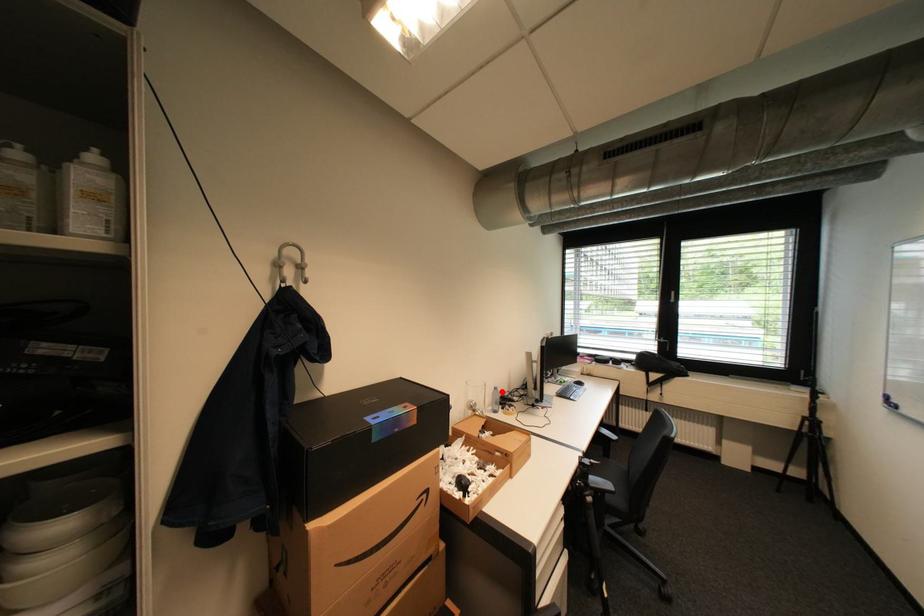
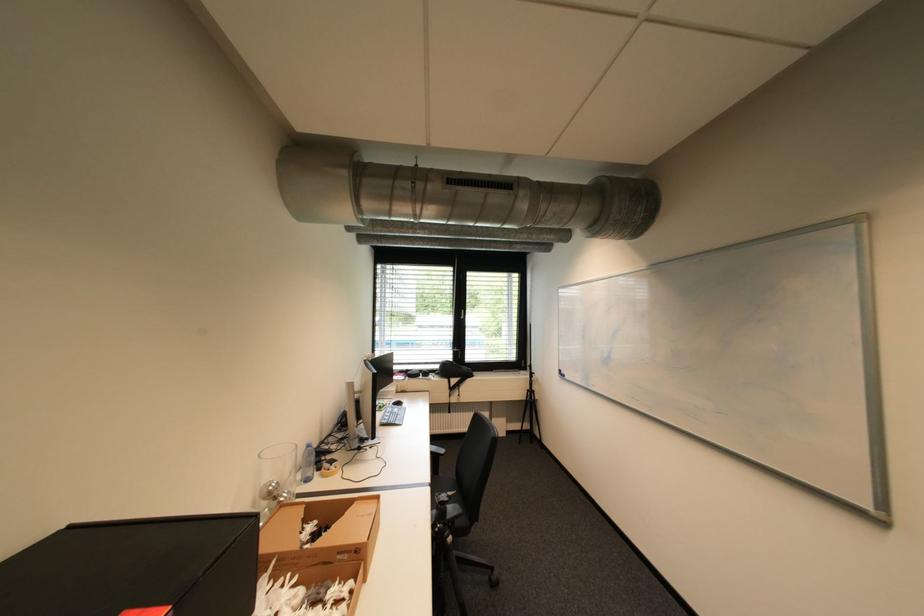
Question: I am providing you with two images of the same scene from different viewpoints. In image1, a red point is highlighted. Considering the same 3D point in image2, which of the following is correct?

Choices:
 (A) It is closer
 (B) It is farther

Answer: (A)